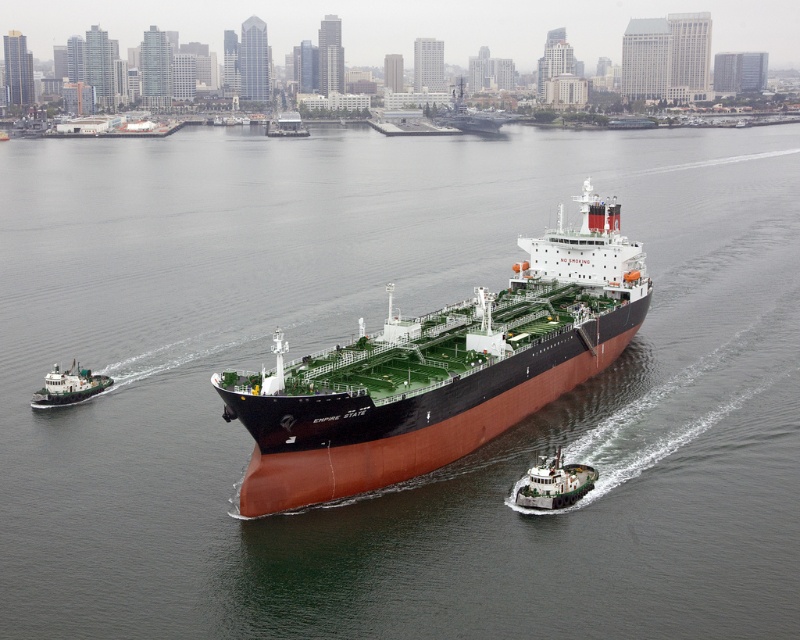
You are a harbor pilot guiding the rustic brown ship at center and the rustic metal barge at center through a narrow channel. The channel is only wide enough for one vessel at a time. Which vessel should you prioritize to pass through first?

The rustic metal barge at center is smaller in size compared to the rustic brown ship at center, so you should prioritize the rustic metal barge at center to pass through the narrow channel first.

You are a harbor pilot guiding the rustic brown ship at center and the rustic metal barge at center through a narrow channel. Which vessel should you prioritize moving forward to avoid collision?

The rustic brown ship at center is in front of rustic metal barge at center, so you should prioritize moving the rustic metal barge at center backward to avoid collision.

You are a harbor pilot guiding the rustic brown ship at center through the harbor. You need to position it precisely at coordinates 0.580, 0.551. Is the ship already at the correct coordinates?

Yes, the rustic brown ship at center is already located at point 0.551, so it is correctly positioned.